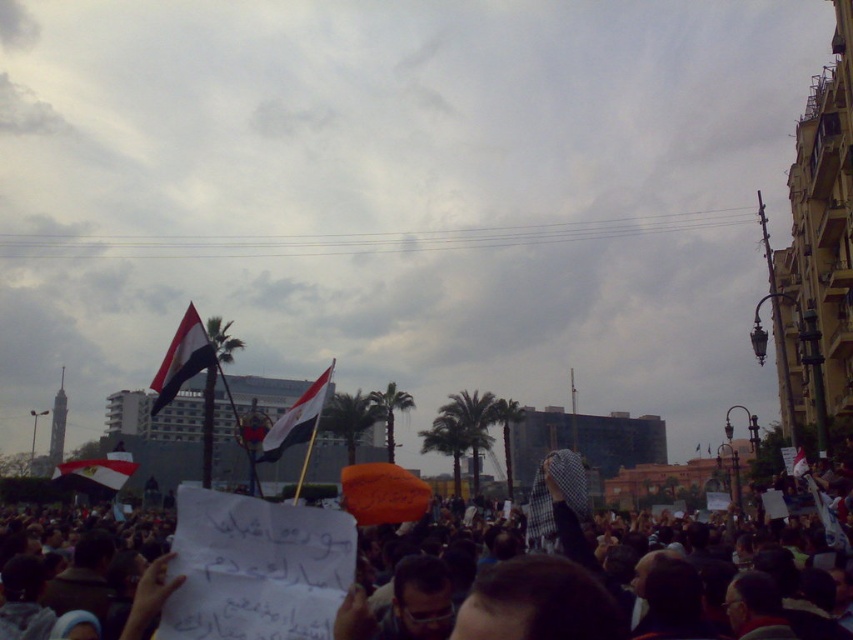
Between white paper sign at lower center and red fabric flag at upper left, which one appears on the left side from the viewer's perspective?

Positioned to the left is red fabric flag at upper left.

Does white paper sign at lower center appear on the left side of red fabric flag at upper left?

No, white paper sign at lower center is not to the left of red fabric flag at upper left.

Between point (318, 586) and point (180, 333), which one is positioned in front?

Point (318, 586) is in front.

This screenshot has width=853, height=640. What are the coordinates of `white paper sign at lower center` in the screenshot? It's located at (421, 579).

Who is positioned more to the left, white paper sign at lower center or white fabric flag at center?

From the viewer's perspective, white fabric flag at center appears more on the left side.

Who is lower down, white paper sign at lower center or white fabric flag at center?

white paper sign at lower center is lower down.

You are a GUI agent. You are given a task and a screenshot of the screen. Output one action in this format:
    pyautogui.click(x=<x>, y=<y>)
    Task: Click on the white paper sign at lower center
    
    Given the screenshot: What is the action you would take?
    pyautogui.click(x=421, y=579)

Locate an element on the screen. white paper sign at lower center is located at coordinates (421, 579).

Who is more distant from viewer, [282,525] or [70,486]?

The point [70,486] is more distant.

Looking at this image, who is more forward, (444, 628) or (71, 483)?

Positioned in front is point (444, 628).

Find the location of `white paper sign at lower center`. white paper sign at lower center is located at coordinates (x=421, y=579).